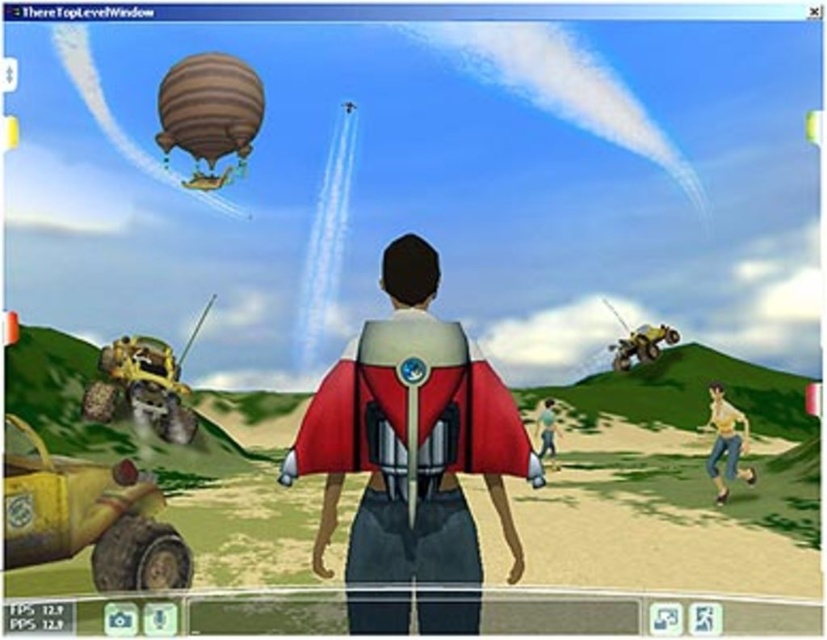
Question: Does shiny metallic jetpack at center appear over skinny jeans at lower right?

Choices:
 (A) yes
 (B) no

Answer: (A)

Question: Estimate the real-world distances between objects in this image. Which object is farther from the striped fabric hot air balloon at upper left?

Choices:
 (A) skinny jeans at lower right
 (B) shiny metallic jetpack at center

Answer: (A)

Question: Does shiny metallic jetpack at center come in front of striped fabric hot air balloon at upper left?

Choices:
 (A) yes
 (B) no

Answer: (A)

Question: Which is farther from the skinny jeans at lower right?

Choices:
 (A) striped fabric hot air balloon at upper left
 (B) shiny metallic jetpack at center

Answer: (A)

Question: Observing the image, what is the correct spatial positioning of shiny metallic jetpack at center in reference to smooth brown hair at center?

Choices:
 (A) left
 (B) right

Answer: (A)

Question: Among these objects, which one is nearest to the camera?

Choices:
 (A) smooth brown hair at center
 (B) skinny jeans at lower right
 (C) shiny metallic jetpack at center

Answer: (C)